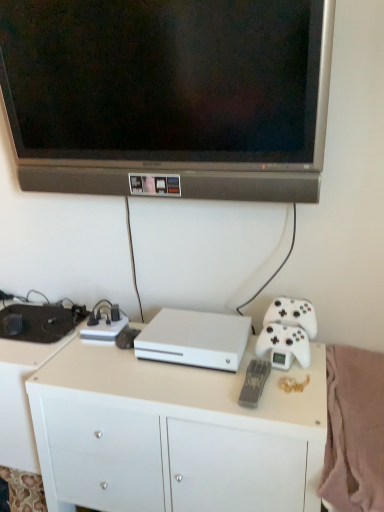
What is the approximate width of white matte console at center?

9.36 inches.

In the scene shown: Measure the distance between point (x=181, y=362) and camera.

Point (x=181, y=362) is 3.83 feet away from camera.

Describe the element at coordinates (354, 430) in the screenshot. I see `soft pink fleece blanket at lower right` at that location.

What do you see at coordinates (28, 373) in the screenshot? Image resolution: width=384 pixels, height=512 pixels. I see `white matte desk at lower left, the second desk from the right` at bounding box center [28, 373].

Measure the distance between white matte game controller at right and camera.

white matte game controller at right is 3.69 feet from camera.

You are a GUI agent. You are given a task and a screenshot of the screen. Output one action in this format:
    pyautogui.click(x=<x>, y=<y>)
    Task: Click on the white matte console at center
    This screenshot has height=512, width=384.
    Given the screenshot: What is the action you would take?
    pyautogui.click(x=194, y=339)

Considering the sizes of objects white matte console at center and white matte desk at center, which ranks as the second desk in left-to-right order, in the image provided, who is thinner, white matte console at center or white matte desk at center, which ranks as the second desk in left-to-right order,?

white matte console at center.

Is white matte console at center with white matte desk at center, which ranks as the second desk in left-to-right order?

No, white matte console at center is not making contact with white matte desk at center, which ranks as the second desk in left-to-right order.

Is white matte console at center situated inside white matte desk at center, which ranks as the second desk in left-to-right order, or outside?

white matte console at center is spatially situated outside white matte desk at center, which ranks as the second desk in left-to-right order.

Is matte black television at upper center closer to the viewer compared to white matte desk at center, positioned as the 1th desk in right-to-left order?

Yes, matte black television at upper center is in front of white matte desk at center, positioned as the 1th desk in right-to-left order.

Would you consider matte black television at upper center to be distant from white matte desk at center, which ranks as the second desk in left-to-right order?

No, matte black television at upper center is in close proximity to white matte desk at center, which ranks as the second desk in left-to-right order.

Is matte black television at upper center wider or thinner than white matte desk at center, which ranks as the second desk in left-to-right order?

Clearly, matte black television at upper center has less width compared to white matte desk at center, which ranks as the second desk in left-to-right order.

From the image's perspective, which is above, matte black television at upper center or white matte desk at center, positioned as the 1th desk in right-to-left order?

From the image's view, matte black television at upper center is above.

Considering the positions of objects matte black television at upper center and soft pink fleece blanket at lower right in the image provided, who is more to the left, matte black television at upper center or soft pink fleece blanket at lower right?

From the viewer's perspective, matte black television at upper center appears more on the left side.

How many degrees apart are the facing directions of matte black television at upper center and soft pink fleece blanket at lower right?

0.141 degrees separate the facing orientations of matte black television at upper center and soft pink fleece blanket at lower right.

Is matte black television at upper center not close to soft pink fleece blanket at lower right?

No, matte black television at upper center is not far away from soft pink fleece blanket at lower right.

Consider the image. Can you confirm if matte black television at upper center is bigger than soft pink fleece blanket at lower right?

Indeed, matte black television at upper center has a larger size compared to soft pink fleece blanket at lower right.

From the image's perspective, is white matte desk at lower left, the second desk from the right, located above or below white matte console at center?

Clearly, from the image's perspective, white matte desk at lower left, the second desk from the right, is below white matte console at center.

Is point (18, 435) positioned before point (197, 356)?

No, it is not.

Is white matte desk at lower left, the second desk from the right, not near white matte console at center?

No, there isn't a large distance between white matte desk at lower left, the second desk from the right, and white matte console at center.

Identify the location of computer that is on the right side of white matte desk at lower left, placed as the 1th desk when sorted from left to right. (194, 339).

Considering the sizes of soft pink fleece blanket at lower right and white matte desk at lower left, placed as the 1th desk when sorted from left to right, in the image, is soft pink fleece blanket at lower right wider or thinner than white matte desk at lower left, placed as the 1th desk when sorted from left to right,?

Clearly, soft pink fleece blanket at lower right has more width compared to white matte desk at lower left, placed as the 1th desk when sorted from left to right.

Which object is positioned more to the left, soft pink fleece blanket at lower right or white matte desk at lower left, the second desk from the right?

From the viewer's perspective, white matte desk at lower left, the second desk from the right, appears more on the left side.

Can you tell me how much soft pink fleece blanket at lower right and white matte desk at lower left, the second desk from the right, differ in facing direction?

They differ by 0.141 degrees in their facing directions.

Considering the sizes of objects soft pink fleece blanket at lower right and white matte desk at center, which ranks as the second desk in left-to-right order, in the image provided, who is thinner, soft pink fleece blanket at lower right or white matte desk at center, which ranks as the second desk in left-to-right order,?

white matte desk at center, which ranks as the second desk in left-to-right order.

Which of these two, soft pink fleece blanket at lower right or white matte desk at center, positioned as the 1th desk in right-to-left order, stands taller?

Standing taller between the two is white matte desk at center, positioned as the 1th desk in right-to-left order.

Is soft pink fleece blanket at lower right turned away from white matte desk at center, positioned as the 1th desk in right-to-left order?

No, white matte desk at center, positioned as the 1th desk in right-to-left order, is not at the back of soft pink fleece blanket at lower right.

In the scene shown: Which object is more forward, soft pink fleece blanket at lower right or white matte desk at center, which ranks as the second desk in left-to-right order?

soft pink fleece blanket at lower right is more forward.

How many degrees apart are the facing directions of matte black television at upper center and white matte desk at lower left, placed as the 1th desk when sorted from left to right?

0.000269 degrees.

At what (x,y) coordinates should I click in order to perform the action: click on television above the white matte desk at lower left, placed as the 1th desk when sorted from left to right (from the image's perspective). Please return your answer as a coordinate pair (x, y). Looking at the image, I should click on (168, 96).

Who is shorter, matte black television at upper center or white matte desk at lower left, placed as the 1th desk when sorted from left to right?

matte black television at upper center is shorter.

Between matte black television at upper center and white matte desk at lower left, placed as the 1th desk when sorted from left to right, which one has larger size?

white matte desk at lower left, placed as the 1th desk when sorted from left to right.

Locate an element on the screen. The height and width of the screenshot is (512, 384). the 2nd desk below the white matte console at center (from the image's perspective) is located at coordinates tap(175, 434).

Where is `the 1st desk behind the matte black television at upper center`? the 1st desk behind the matte black television at upper center is located at coordinates (175, 434).

Which object lies nearer to the anchor point white matte desk at center, positioned as the 1th desk in right-to-left order, white matte desk at lower left, placed as the 1th desk when sorted from left to right, or soft pink fleece blanket at lower right?

white matte desk at lower left, placed as the 1th desk when sorted from left to right, is positioned closer to the anchor white matte desk at center, positioned as the 1th desk in right-to-left order.

When comparing their distances from white matte desk at lower left, placed as the 1th desk when sorted from left to right, does white matte desk at center, which ranks as the second desk in left-to-right order, or soft pink fleece blanket at lower right seem closer?

white matte desk at center, which ranks as the second desk in left-to-right order, is positioned closer to the anchor white matte desk at lower left, placed as the 1th desk when sorted from left to right.

Which object lies nearer to the anchor point white matte console at center, matte black television at upper center or white matte desk at lower left, the second desk from the right?

white matte desk at lower left, the second desk from the right, is positioned closer to the anchor white matte console at center.

Which object lies nearer to the anchor point soft pink fleece blanket at lower right, white matte desk at center, positioned as the 1th desk in right-to-left order, or white matte desk at lower left, placed as the 1th desk when sorted from left to right?

white matte desk at center, positioned as the 1th desk in right-to-left order, lies closer to soft pink fleece blanket at lower right than the other object.

From the image, which object appears to be farther from matte black television at upper center, soft pink fleece blanket at lower right or white matte console at center?

soft pink fleece blanket at lower right is positioned further to the anchor matte black television at upper center.

When comparing their distances from white matte console at center, does white matte game controller at right or matte black television at upper center seem further?

matte black television at upper center is further to white matte console at center.

Looking at the image, which one is located closer to white matte desk at center, which ranks as the second desk in left-to-right order, soft pink fleece blanket at lower right or white matte console at center?

Among the two, white matte console at center is located nearer to white matte desk at center, which ranks as the second desk in left-to-right order.

From the image, which object appears to be nearer to white matte desk at lower left, placed as the 1th desk when sorted from left to right, soft pink fleece blanket at lower right or white matte game controller at right?

white matte game controller at right is positioned closer to the anchor white matte desk at lower left, placed as the 1th desk when sorted from left to right.

Find the location of a particular element. Image resolution: width=384 pixels, height=512 pixels. game controller between white matte console at center and soft pink fleece blanket at lower right in the horizontal direction is located at coordinates (287, 332).

At what (x,y) coordinates should I click in order to perform the action: click on computer that lies between matte black television at upper center and soft pink fleece blanket at lower right from top to bottom. Please return your answer as a coordinate pair (x, y). Looking at the image, I should click on (194, 339).

This screenshot has height=512, width=384. I want to click on computer located between white matte desk at lower left, the second desk from the right, and soft pink fleece blanket at lower right in the left-right direction, so click(x=194, y=339).

Locate an element on the screen. game controller between matte black television at upper center and white matte desk at center, positioned as the 1th desk in right-to-left order, vertically is located at coordinates (287, 332).